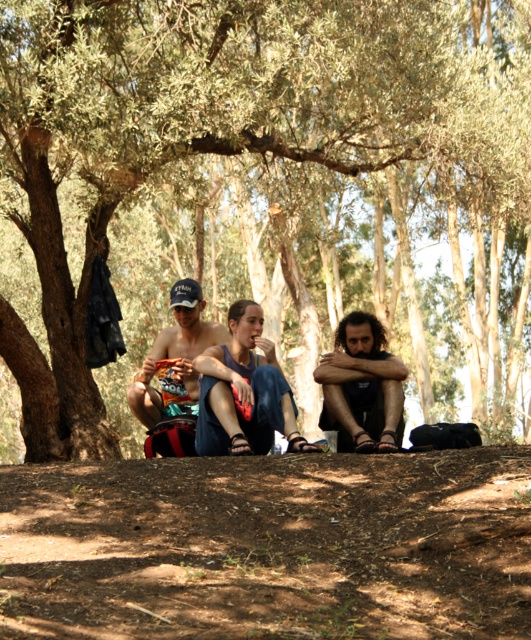
Based on the photo, does green leafy tree at center appear on the right side of dark brown hair at center?

No, green leafy tree at center is not to the right of dark brown hair at center.

Can you confirm if green leafy tree at center is positioned below dark brown hair at center?

Actually, green leafy tree at center is above dark brown hair at center.

Which is in front, point (96, 410) or point (363, 401)?

Positioned in front is point (363, 401).

Find the location of a particular element. green leafy tree at center is located at coordinates (264, 193).

Does blue denim jeans at center appear on the right side of dark brown hair at center?

No, blue denim jeans at center is not to the right of dark brown hair at center.

From the picture: Is blue denim jeans at center further to the viewer compared to dark brown hair at center?

No, blue denim jeans at center is closer to the viewer.

The height and width of the screenshot is (640, 531). I want to click on blue denim jeans at center, so click(244, 392).

Does point (444, 136) come behind point (266, 432)?

Yes, it is behind point (266, 432).

Between green leafy tree at center and blue denim jeans at center, which one has less height?

Answer: Standing shorter between the two is blue denim jeans at center.

Which is in front, point (72, 35) or point (210, 413)?

Point (210, 413)

Image resolution: width=531 pixels, height=640 pixels. I want to click on green leafy tree at center, so click(x=264, y=193).